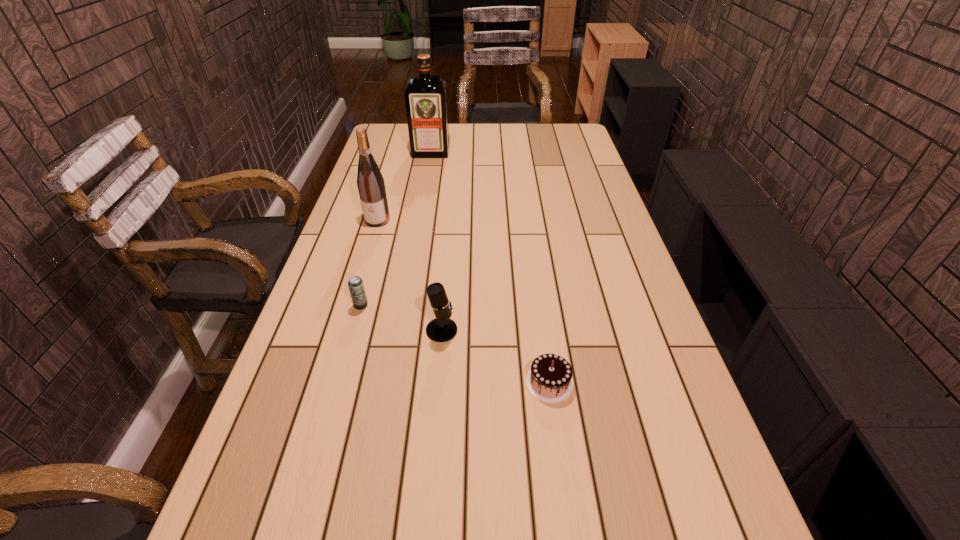
Find the location of a particular element. The height and width of the screenshot is (540, 960). vacant region located 0.300m on the right of the second farthest object is located at coordinates (480, 220).

Where is `vacant region located on the front of the third tallest object`? vacant region located on the front of the third tallest object is located at coordinates (431, 457).

This screenshot has height=540, width=960. I want to click on vacant space located 0.400m on the back of the third nearest object, so click(x=386, y=217).

What are the coordinates of `vacant space situated on the back of the nearest object` in the screenshot? It's located at (533, 265).

Where is `object that is positioned at the far edge`? This screenshot has height=540, width=960. object that is positioned at the far edge is located at coordinates (425, 96).

At what (x,y) coordinates should I click in order to perform the action: click on wine bottle located in the left edge section of the desktop. Please return your answer as a coordinate pair (x, y). This screenshot has width=960, height=540. Looking at the image, I should click on (370, 182).

Where is `beer can that is at the left edge`? beer can that is at the left edge is located at coordinates (356, 287).

Where is `free space at the far edge`? The height and width of the screenshot is (540, 960). free space at the far edge is located at coordinates [496, 136].

Image resolution: width=960 pixels, height=540 pixels. In the image, there is a desktop. In order to click on vacant region at the left edge in this screenshot , I will do coord(330,397).

This screenshot has height=540, width=960. In the image, there is a desktop. Find the location of `vacant space at the right edge`. vacant space at the right edge is located at coordinates (622, 319).